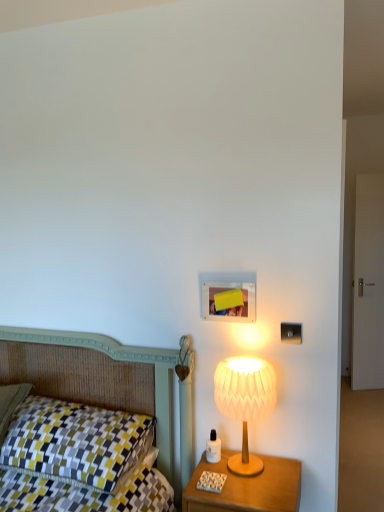
Question: Looking at their shapes, would you say checkered fabric pillow at left is wider or thinner than wooden nightstand at right?

Choices:
 (A) wide
 (B) thin

Answer: (A)

Question: From the image's perspective, is checkered fabric pillow at left above or below wooden nightstand at right?

Choices:
 (A) below
 (B) above

Answer: (B)

Question: Considering the real-world distances, which object is farthest from the wooden nightstand at right?

Choices:
 (A) checkered fabric pillow at left
 (B) white paper lampshade at right

Answer: (A)

Question: Based on their relative distances, which object is nearer to the white paper lampshade at right?

Choices:
 (A) wooden nightstand at right
 (B) checkered fabric pillow at left

Answer: (A)